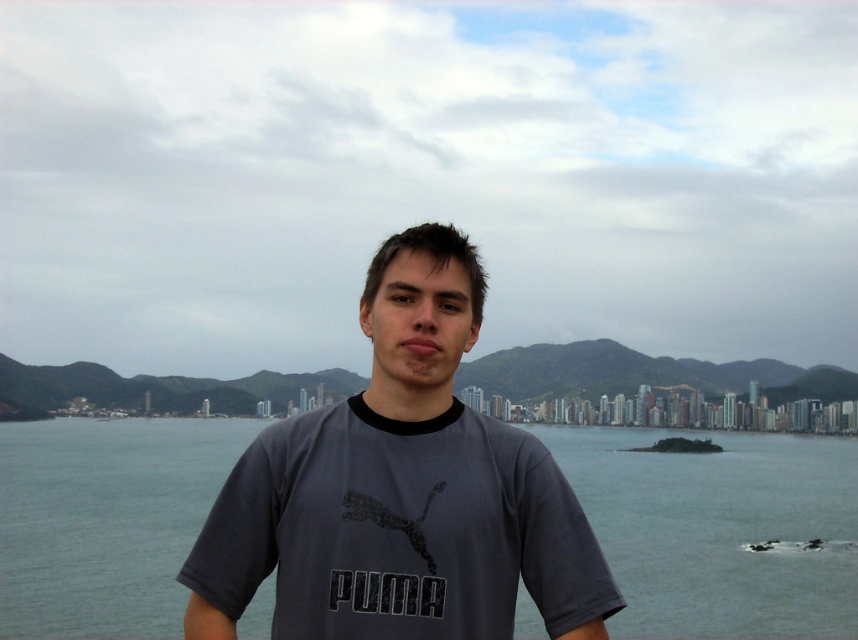
You are a photographer trying to capture the scenic backdrop. You notice a point marked at coordinates [720,531]. Based on the scene description, what is the color of the water at that location?

The point at coordinates [720,531] marks gray water at center, so the water there is gray in color.

You are a photographer trying to capture the scenic backdrop. You need to focus your camera on the gray water at center. According to the coordinates provided, where exactly should you aim your camera lens?

The gray water at center is located at coordinates point (720, 531), so aim your camera lens there to focus on it.

You are a photographer adjusting your camera settings to capture the scenic backdrop. You notice two points in your frame at coordinates point (x=790, y=464) and point (x=442, y=305). Which point is closer to your camera lens?

Point (x=790, y=464) is further to the viewer than point (x=442, y=305), so the point (x=442, y=305) is closer to the camera lens.